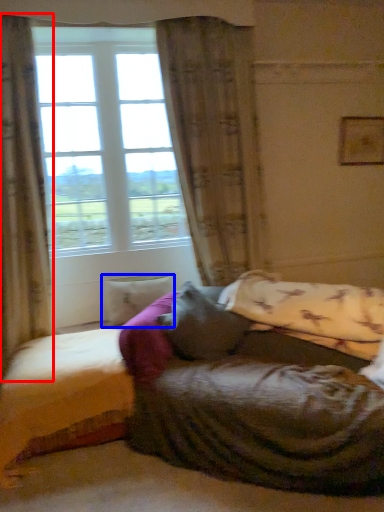
Question: Which point is further to the camera, curtain (highlighted by a red box) or pillow (highlighted by a blue box)?

Choices:
 (A) curtain
 (B) pillow

Answer: (B)